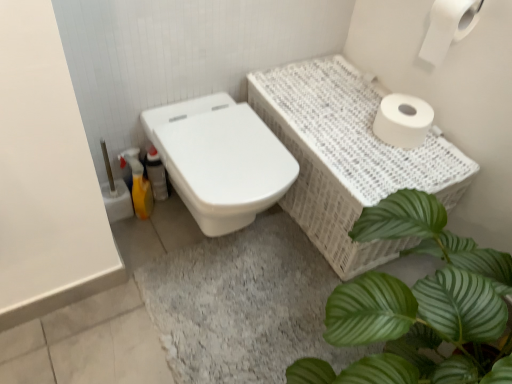
Question: From the image's perspective, is white matte toilet paper at upper right, positioned as the 2th toilet paper in bottom-to-top order, under yellow plastic bottle at lower left?

Choices:
 (A) no
 (B) yes

Answer: (A)

Question: Would you say white matte toilet paper at upper right, the first toilet paper when ordered from top to bottom, contains yellow plastic bottle at lower left?

Choices:
 (A) yes
 (B) no

Answer: (B)

Question: Is the surface of white matte toilet paper at upper right, positioned as the 2th toilet paper in bottom-to-top order, in direct contact with yellow plastic bottle at lower left?

Choices:
 (A) yes
 (B) no

Answer: (B)

Question: Considering the relative sizes of white matte toilet paper at upper right, positioned as the 2th toilet paper in bottom-to-top order, and yellow plastic bottle at lower left in the image provided, is white matte toilet paper at upper right, positioned as the 2th toilet paper in bottom-to-top order, wider than yellow plastic bottle at lower left?

Choices:
 (A) yes
 (B) no

Answer: (A)

Question: Considering the relative positions of white matte toilet paper at upper right, positioned as the 2th toilet paper in bottom-to-top order, and yellow plastic bottle at lower left in the image provided, is white matte toilet paper at upper right, positioned as the 2th toilet paper in bottom-to-top order, behind yellow plastic bottle at lower left?

Choices:
 (A) yes
 (B) no

Answer: (B)

Question: Is yellow plastic bottle at lower left to the left or to the right of white glossy toilet at center in the image?

Choices:
 (A) left
 (B) right

Answer: (A)

Question: Considering the positions of point (128, 158) and point (253, 134), is point (128, 158) closer or farther from the camera than point (253, 134)?

Choices:
 (A) farther
 (B) closer

Answer: (A)

Question: Is yellow plastic bottle at lower left inside or outside of white glossy toilet at center?

Choices:
 (A) outside
 (B) inside

Answer: (A)

Question: In terms of height, does yellow plastic bottle at lower left look taller or shorter compared to white glossy toilet at center?

Choices:
 (A) tall
 (B) short

Answer: (B)

Question: Is yellow plastic bottle at lower left situated inside green leafy plant at lower right or outside?

Choices:
 (A) inside
 (B) outside

Answer: (B)

Question: From a real-world perspective, is yellow plastic bottle at lower left physically located above or below green leafy plant at lower right?

Choices:
 (A) above
 (B) below

Answer: (B)

Question: Considering the positions of yellow plastic bottle at lower left and green leafy plant at lower right in the image, is yellow plastic bottle at lower left wider or thinner than green leafy plant at lower right?

Choices:
 (A) thin
 (B) wide

Answer: (A)

Question: Visually, is yellow plastic bottle at lower left positioned to the left or to the right of green leafy plant at lower right?

Choices:
 (A) right
 (B) left

Answer: (B)

Question: Would you say yellow plastic bottle at lower left is inside or outside white matte toilet paper at upper right, the second toilet paper from the top?

Choices:
 (A) outside
 (B) inside

Answer: (A)

Question: In the image, is yellow plastic bottle at lower left positioned in front of or behind white matte toilet paper at upper right, which appears as the first toilet paper when ordered from the bottom?

Choices:
 (A) behind
 (B) front

Answer: (A)